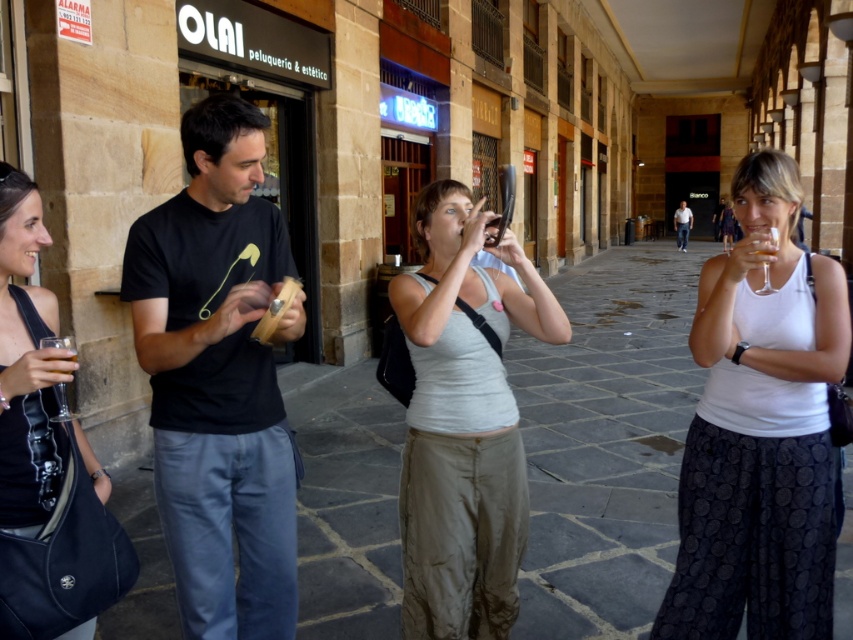
You are a photographer trying to capture a photo of the light blue jeans at center and the translucent glass at upper right. Since you want both objects to appear the same size in the photo, which object should you move closer to the camera?

The translucent glass at upper right should be moved closer to the camera because the light blue jeans at center is already larger in size than the translucent glass at upper right.